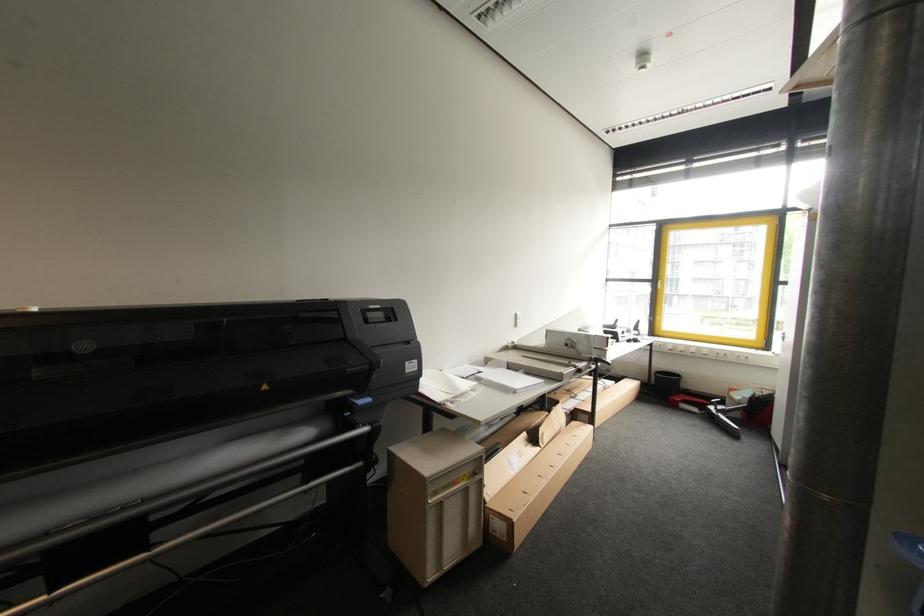
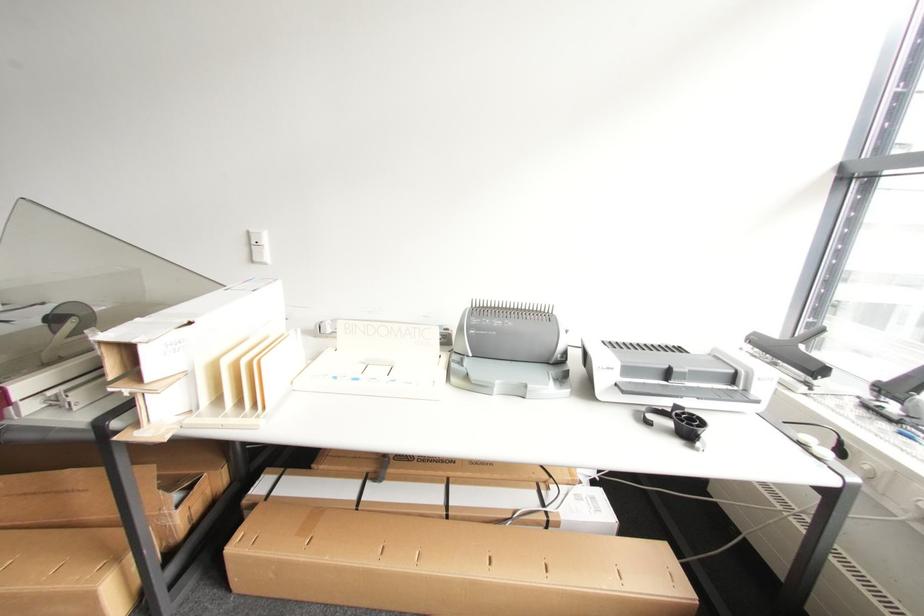
The point at (521, 321) is marked in the first image. Where is the corresponding point in the second image?

(257, 248)